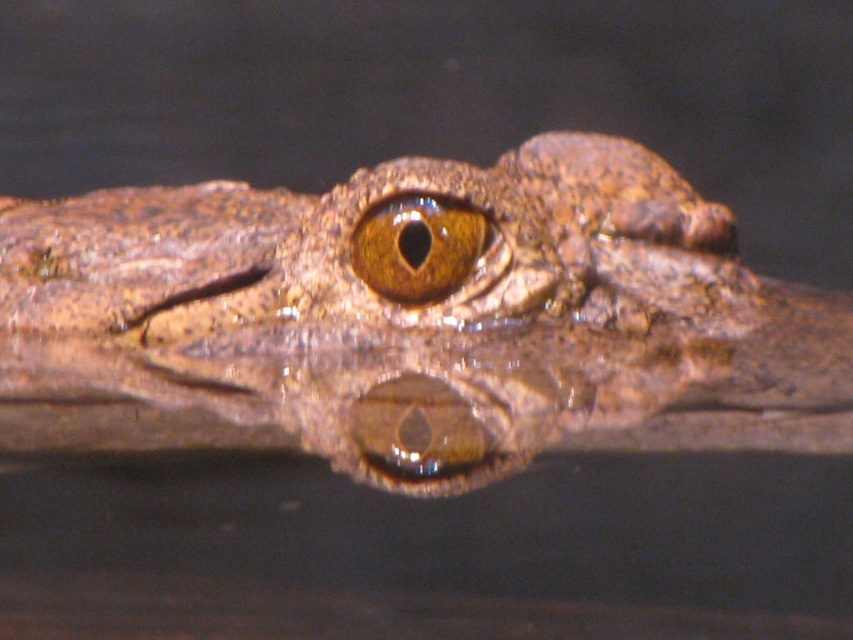
Question: Does brown scaly crocodile at center appear over brown matte eye at center?

Choices:
 (A) no
 (B) yes

Answer: (A)

Question: Which of the following is the farthest from the observer?

Choices:
 (A) (466, 227)
 (B) (403, 433)

Answer: (A)

Question: Does brown scaly crocodile at center have a larger size compared to brown matte eye at center?

Choices:
 (A) no
 (B) yes

Answer: (B)

Question: Can you confirm if brown scaly crocodile at center is positioned above brown matte eye at center?

Choices:
 (A) no
 (B) yes

Answer: (A)

Question: Which of the following is the farthest from the observer?

Choices:
 (A) brown scaly crocodile at center
 (B) brown matte eye at center

Answer: (B)